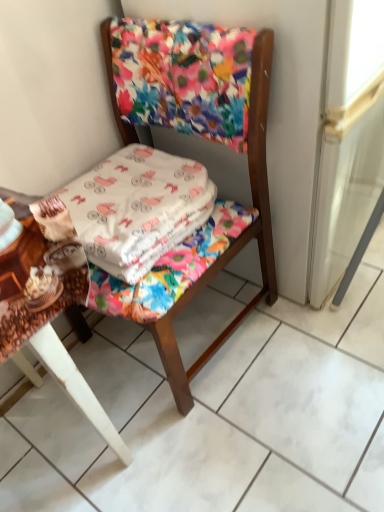
The image size is (384, 512). I want to click on free space in front of floral fabric screen door at upper center, so click(299, 384).